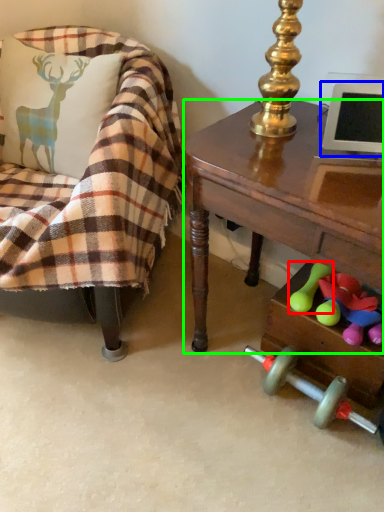
Question: Based on their relative distances, which object is farther from toy (highlighted by a red box)? Choose from computer monitor (highlighted by a blue box) and desk (highlighted by a green box).

Choices:
 (A) computer monitor
 (B) desk

Answer: (A)